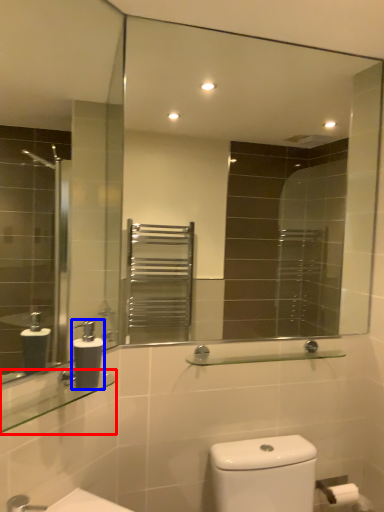
Question: Which of the following is the farthest to the observer, balustrade (highlighted by a red box) or soap dispenser (highlighted by a blue box)?

Choices:
 (A) balustrade
 (B) soap dispenser

Answer: (B)